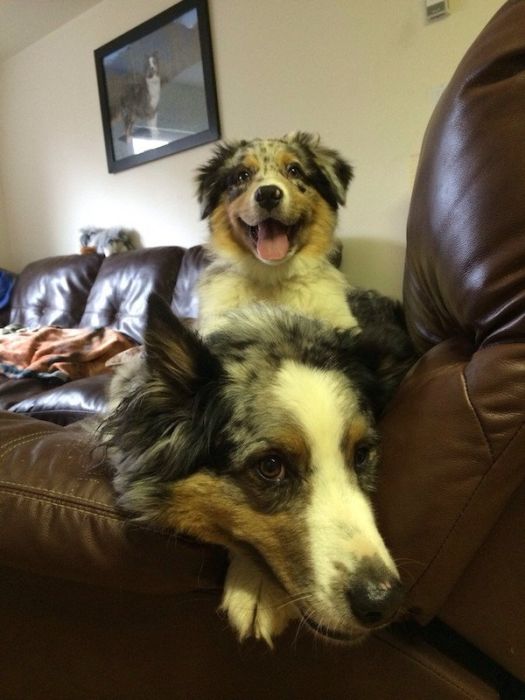
Where is `sofa`? This screenshot has height=700, width=525. sofa is located at coordinates (109, 318).